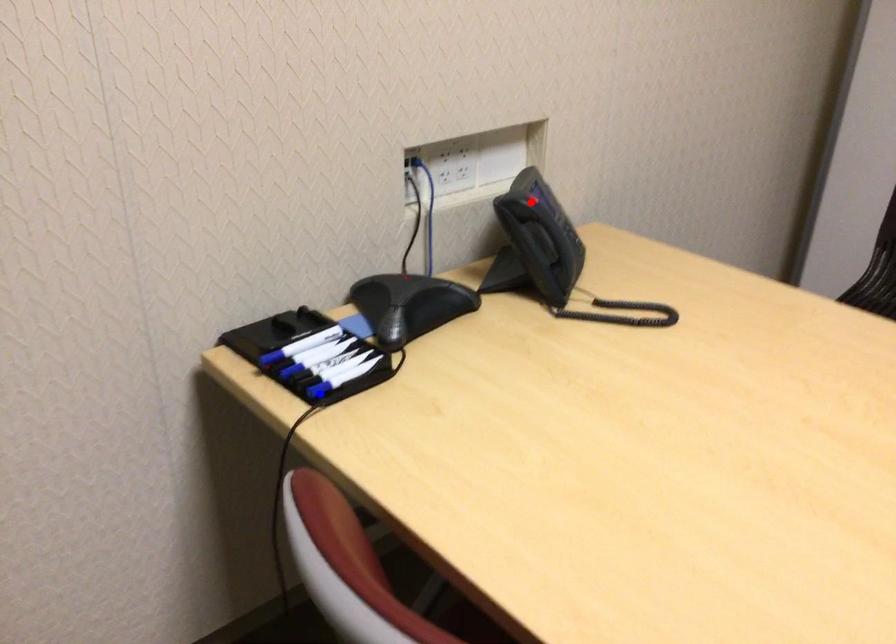
Question: Two points are marked on the image. Which point is closer to the camera?

Choices:
 (A) Blue point is closer.
 (B) Red point is closer.

Answer: (A)